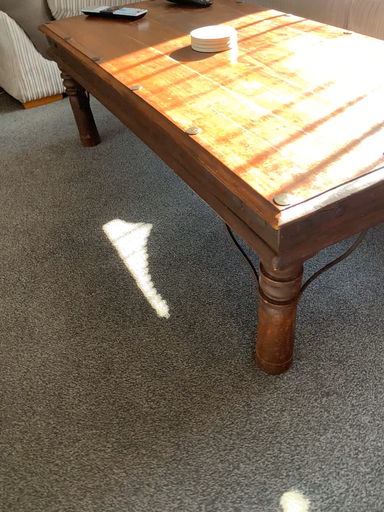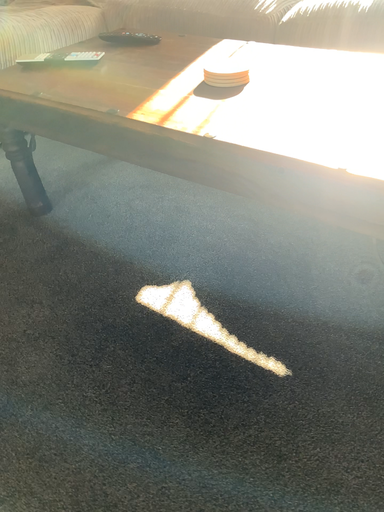
Question: Which way did the camera rotate in the video?

Choices:
 (A) rotated left
 (B) rotated right

Answer: (B)